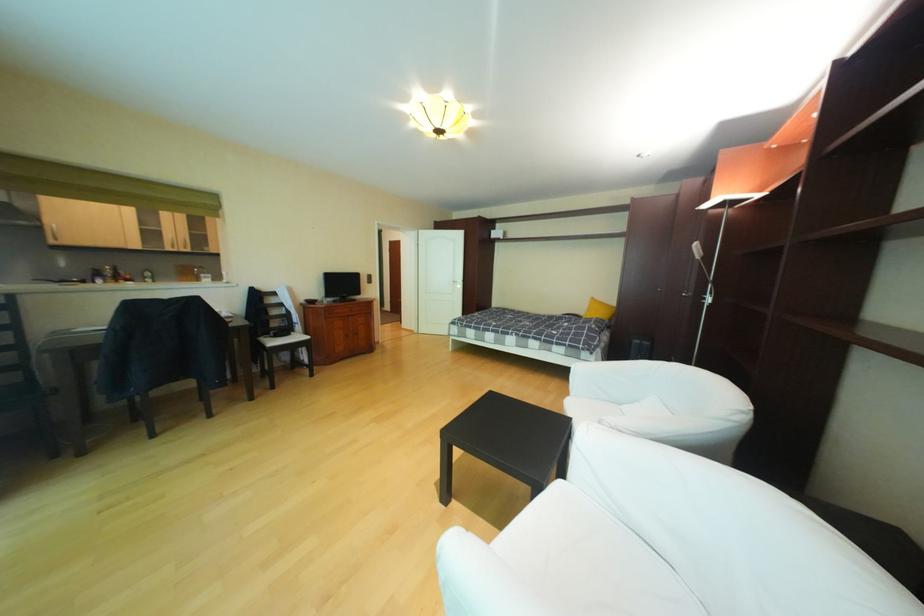
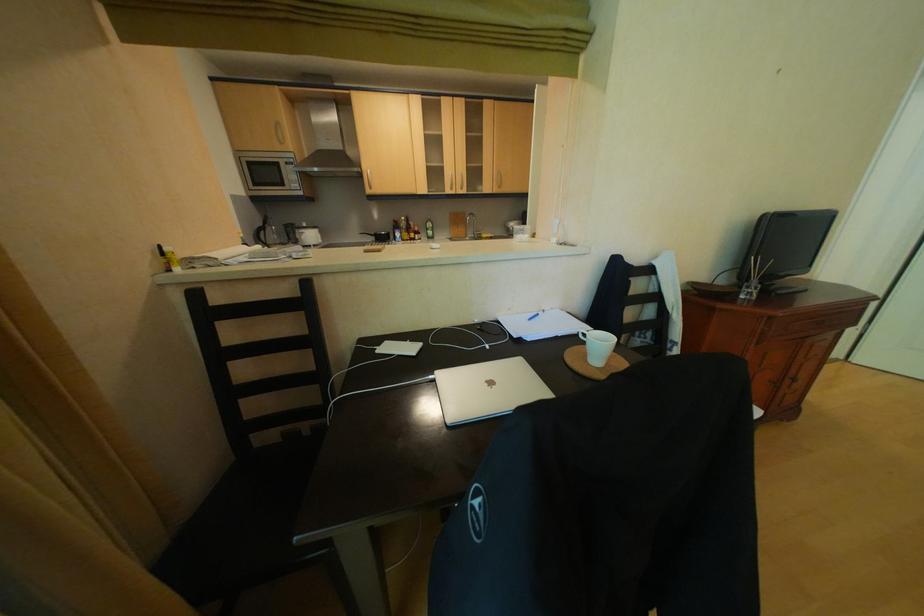
Locate, in the second image, the point that corresponds to (140,278) in the first image.

(429, 230)